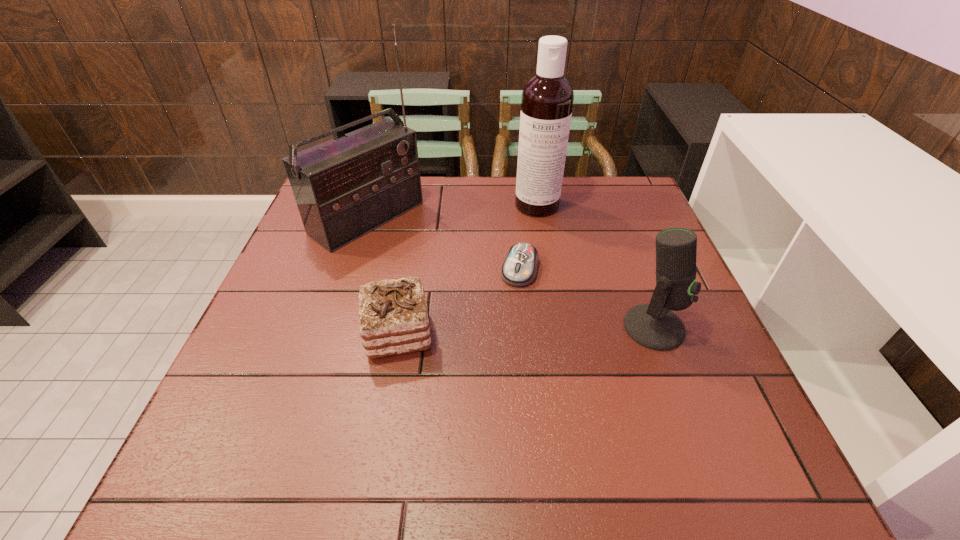
Identify the location of unoccupied position between the rightmost object and the dishwasher detergent. (595, 266).

You are a GUI agent. You are given a task and a screenshot of the screen. Output one action in this format:
    pyautogui.click(x=<x>, y=<y>)
    Task: Click on the free space between the radio receiver and the dishwasher detergent
    
    Given the screenshot: What is the action you would take?
    pyautogui.click(x=452, y=212)

The height and width of the screenshot is (540, 960). I want to click on free space between the radio receiver and the chocolate cake, so click(382, 275).

This screenshot has height=540, width=960. What are the coordinates of `vacant area that lies between the dishwasher detergent and the chocolate cake` in the screenshot? It's located at point(468,269).

Locate an element on the screen. blank region between the rightmost object and the fourth tallest object is located at coordinates (526, 330).

Choose which object is the nearest neighbor to the dishwasher detergent. Please provide its 2D coordinates. Your answer should be formatted as a tuple, i.e. [(x, y)], where the tuple contains the x and y coordinates of a point satisfying the conditions above.

[(519, 269)]

Identify which object is the third nearest to the dishwasher detergent. Please provide its 2D coordinates. Your answer should be formatted as a tuple, i.e. [(x, y)], where the tuple contains the x and y coordinates of a point satisfying the conditions above.

[(654, 326)]

Where is `free location that satisfies the following two spatial constraints: 1. on the front side of the dishwasher detergent; 2. on the right side of the third tallest object`? The image size is (960, 540). free location that satisfies the following two spatial constraints: 1. on the front side of the dishwasher detergent; 2. on the right side of the third tallest object is located at coordinates (557, 327).

Where is `free location that satisfies the following two spatial constraints: 1. on the back side of the rightmost object; 2. on the right side of the chocolate cake`? free location that satisfies the following two spatial constraints: 1. on the back side of the rightmost object; 2. on the right side of the chocolate cake is located at coordinates (398, 327).

The width and height of the screenshot is (960, 540). I want to click on free location that satisfies the following two spatial constraints: 1. on the back side of the second shortest object; 2. on the right side of the dishwasher detergent, so click(x=420, y=205).